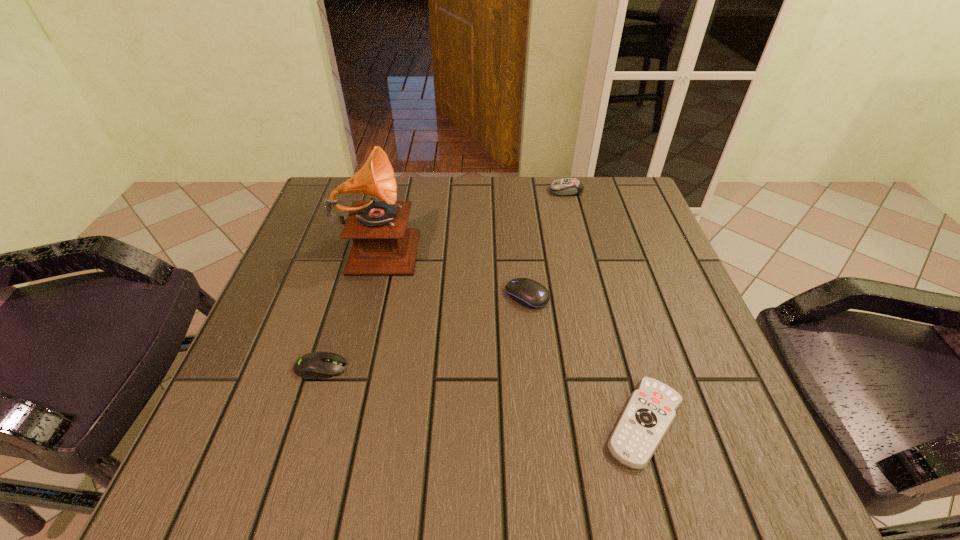
Identify the location of vacant position at the right edge of the desktop. (663, 296).

In the image, there is a desktop. Identify the location of vacant space at the near left corner. The width and height of the screenshot is (960, 540). (300, 450).

At what (x,y) coordinates should I click in order to perform the action: click on free region at the far right corner. Please return your answer as a coordinate pair (x, y). The width and height of the screenshot is (960, 540). Looking at the image, I should click on (636, 197).

Image resolution: width=960 pixels, height=540 pixels. Identify the location of blank space at the near right corner of the desktop. (751, 485).

I want to click on vacant space in between the third object from right to left and the tallest object, so click(453, 271).

Locate an element on the screen. Image resolution: width=960 pixels, height=540 pixels. free space between the nearest object and the leftmost computer mouse is located at coordinates (483, 395).

Identify the location of empty space between the third object from right to left and the farthest object. This screenshot has height=540, width=960. (546, 244).

Identify the location of unoccupied position between the second computer mouse from left to right and the leftmost computer mouse. (424, 332).

I want to click on empty space between the second computer mouse from left to right and the tallest object, so click(x=453, y=271).

Identify the location of vacant space that is in between the farthest object and the nearest computer mouse. Image resolution: width=960 pixels, height=540 pixels. (444, 279).